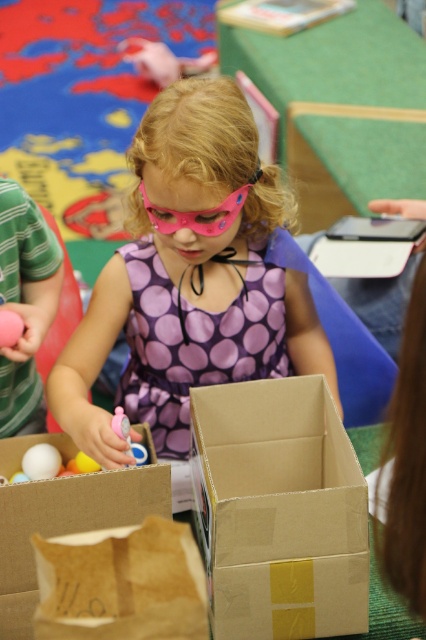
What do you see at coordinates (195, 342) in the screenshot? The image size is (426, 640). I see `purple dotted dress at center` at bounding box center [195, 342].

Which is behind, point (180, 394) or point (178, 227)?

Point (180, 394)

Does point (207, 349) come closer to viewer compared to point (157, 216)?

No, (207, 349) is behind (157, 216).

At what (x,y) coordinates should I click in order to perform the action: click on purple dotted dress at center. Please return your answer as a coordinate pair (x, y). The height and width of the screenshot is (640, 426). Looking at the image, I should click on (195, 342).

Is point (170, 339) farther from camera compared to point (152, 488)?

Yes, point (170, 339) is behind point (152, 488).

Between purple dotted dress at center and cardboard box at center, which one has more height?

purple dotted dress at center is taller.

Who is more forward, (178, 340) or (68, 486)?

Point (68, 486) is more forward.

What are the coordinates of `purple dotted dress at center` in the screenshot? It's located at pos(195,342).

Between point (34, 470) and point (115, 422), which one is positioned in front?

Point (115, 422) is in front.

Which is more to the right, white matte egg at center or matte plastic toy at center?

From the viewer's perspective, matte plastic toy at center appears more on the right side.

Identify the location of white matte egg at center. (40, 461).